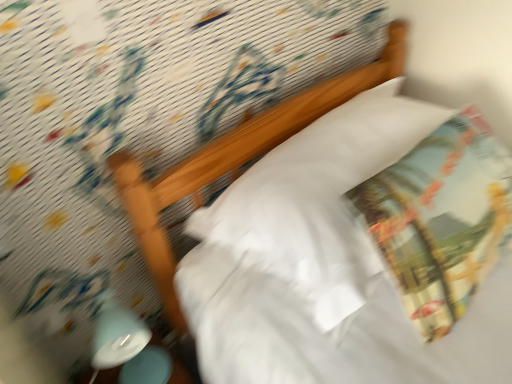
Question: From a real-world perspective, is white soft pillow at center located beneath printed fabric throw pillow at upper right?

Choices:
 (A) no
 (B) yes

Answer: (B)

Question: Could you tell me if white soft pillow at center is turned towards printed fabric throw pillow at upper right?

Choices:
 (A) yes
 (B) no

Answer: (A)

Question: Is white soft pillow at center to the right of printed fabric throw pillow at upper right from the viewer's perspective?

Choices:
 (A) no
 (B) yes

Answer: (A)

Question: From the image's perspective, is white soft pillow at center located above printed fabric throw pillow at upper right?

Choices:
 (A) no
 (B) yes

Answer: (B)

Question: Can you confirm if white soft pillow at center is positioned to the left of printed fabric throw pillow at upper right?

Choices:
 (A) yes
 (B) no

Answer: (A)

Question: Would you say printed fabric throw pillow at upper right is to the left or to the right of white soft pillow at center in the picture?

Choices:
 (A) right
 (B) left

Answer: (A)

Question: Based on their sizes in the image, would you say printed fabric throw pillow at upper right is bigger or smaller than white soft pillow at center?

Choices:
 (A) big
 (B) small

Answer: (B)

Question: Is printed fabric throw pillow at upper right wider or thinner than white soft pillow at center?

Choices:
 (A) thin
 (B) wide

Answer: (A)

Question: From the image's perspective, is printed fabric throw pillow at upper right positioned above or below white soft pillow at center?

Choices:
 (A) above
 (B) below

Answer: (B)

Question: Is white glossy bedside lamp at lower left taller or shorter than printed fabric throw pillow at upper right?

Choices:
 (A) tall
 (B) short

Answer: (A)

Question: Is point (121, 342) positioned closer to the camera than point (377, 248)?

Choices:
 (A) closer
 (B) farther

Answer: (B)

Question: Visually, is white glossy bedside lamp at lower left positioned to the left or to the right of printed fabric throw pillow at upper right?

Choices:
 (A) left
 (B) right

Answer: (A)

Question: Would you say white glossy bedside lamp at lower left is inside or outside printed fabric throw pillow at upper right?

Choices:
 (A) outside
 (B) inside

Answer: (A)

Question: From a real-world perspective, is printed fabric throw pillow at upper right above or below white glossy bedside lamp at lower left?

Choices:
 (A) above
 (B) below

Answer: (A)

Question: Considering the positions of printed fabric throw pillow at upper right and white glossy bedside lamp at lower left in the image, is printed fabric throw pillow at upper right wider or thinner than white glossy bedside lamp at lower left?

Choices:
 (A) wide
 (B) thin

Answer: (A)